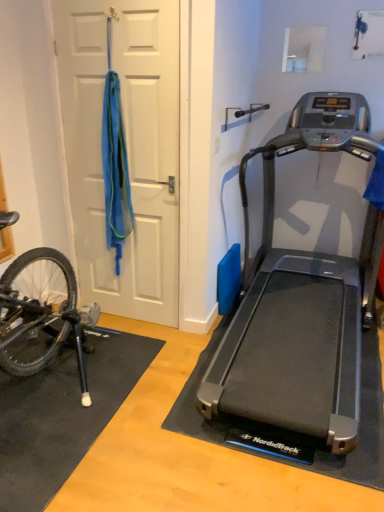
This screenshot has width=384, height=512. Find the location of `vacant area on top of black rubber doormat at lower left (from a real-world perspective)`. vacant area on top of black rubber doormat at lower left (from a real-world perspective) is located at coordinates (66, 391).